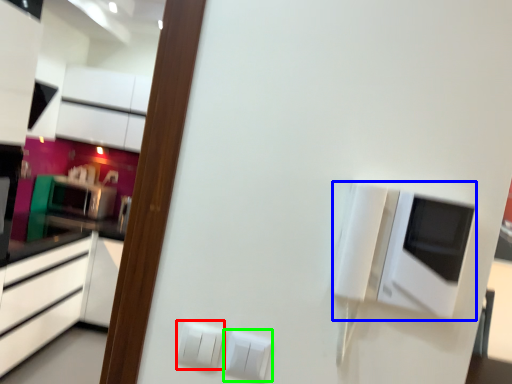
Question: Considering the real-world distances, which object is closest to electric outlet (highlighted by a red box)? appliance (highlighted by a blue box) or electric outlet (highlighted by a green box).

Choices:
 (A) appliance
 (B) electric outlet

Answer: (B)